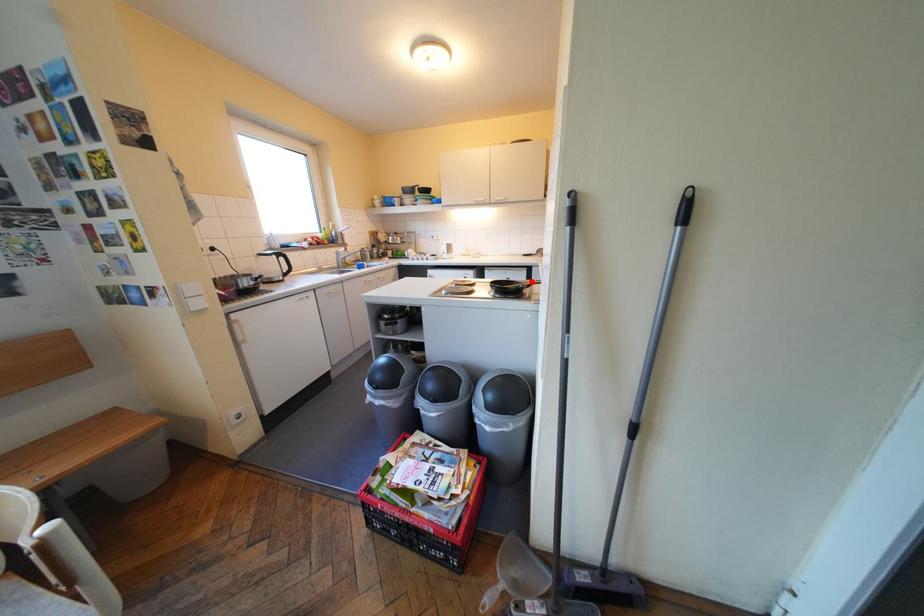
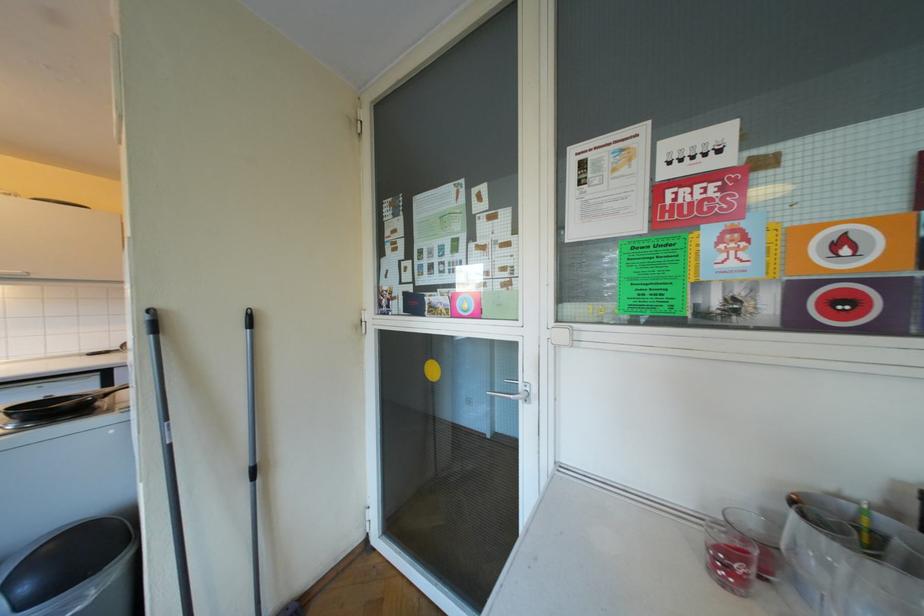
Find the pixel in the second image that matches the highlighted location in the first image.

(95, 394)